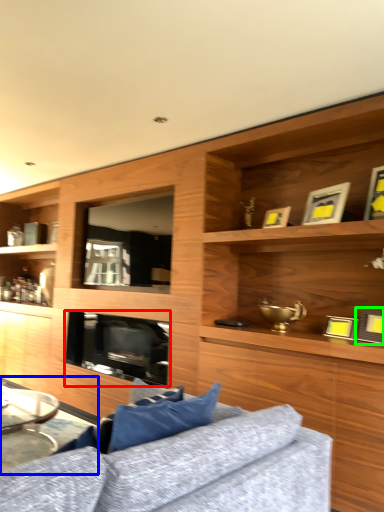
Question: Based on their relative distances, which object is farther from fireplace (highlighted by a red box)? Choose from table (highlighted by a blue box) and picture frame (highlighted by a green box).

Choices:
 (A) table
 (B) picture frame

Answer: (B)